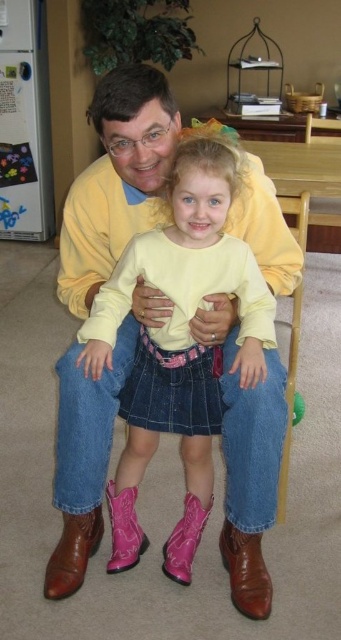
Question: Which point is farther from the camera taking this photo?

Choices:
 (A) (260, 556)
 (B) (127, 74)
 (C) (171, 573)
 (D) (96, 538)

Answer: (D)

Question: Does brown leather boots at lower center come behind pink suede boot at lower center?

Choices:
 (A) yes
 (B) no

Answer: (B)

Question: Which point is closer to the camera?

Choices:
 (A) brown leather boot at lower right
 (B) brown leather boots at lower center

Answer: (B)

Question: Estimate the real-world distances between objects in this image. Which object is closer to the pink suede boot at lower center?

Choices:
 (A) brown leather boot at lower right
 (B) brown leather boots at lower center
 (C) pink leather boot at lower center

Answer: (A)

Question: Can you confirm if brown leather boots at lower center is wider than pink leather boot at lower center?

Choices:
 (A) no
 (B) yes

Answer: (B)

Question: Can you confirm if pink leather boot at lower center is wider than pink suede boot at lower center?

Choices:
 (A) yes
 (B) no

Answer: (B)